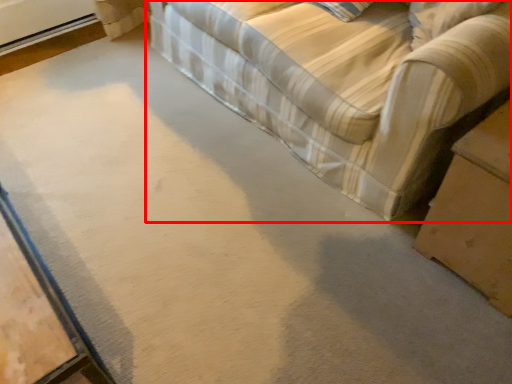
Question: From the image's perspective, what is the correct spatial positioning of studio couch (annotated by the red box) in reference to table?

Choices:
 (A) below
 (B) above

Answer: (B)